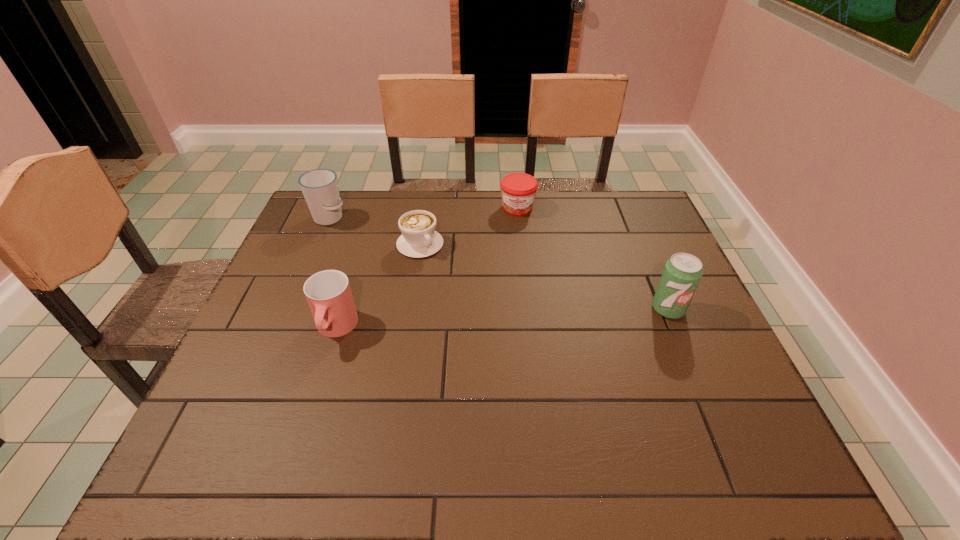
Locate an element on the screen. The image size is (960, 540). free space between the third object from right to left and the rightmost object is located at coordinates point(544,276).

Locate an element on the screen. free space between the second object from left to right and the jam is located at coordinates (426, 268).

Identify the location of free space between the rightmost object and the left cup. (499, 264).

This screenshot has height=540, width=960. What are the coordinates of `free space between the third object from right to left and the nearer cup` in the screenshot? It's located at (378, 287).

Locate an element on the screen. This screenshot has height=540, width=960. unoccupied position between the third farthest object and the rightmost object is located at coordinates (544, 276).

Identify the location of empty space that is in between the third nearest object and the right cup. The width and height of the screenshot is (960, 540). (378, 287).

Where is `free space between the left cup and the soda`? Image resolution: width=960 pixels, height=540 pixels. free space between the left cup and the soda is located at coordinates (499, 264).

Where is `object that ranks as the third closest to the left cup`? The width and height of the screenshot is (960, 540). object that ranks as the third closest to the left cup is located at coordinates (518, 190).

Identify which object is located as the nearest to the soda. Please provide its 2D coordinates. Your answer should be formatted as a tuple, i.e. [(x, y)], where the tuple contains the x and y coordinates of a point satisfying the conditions above.

[(518, 190)]